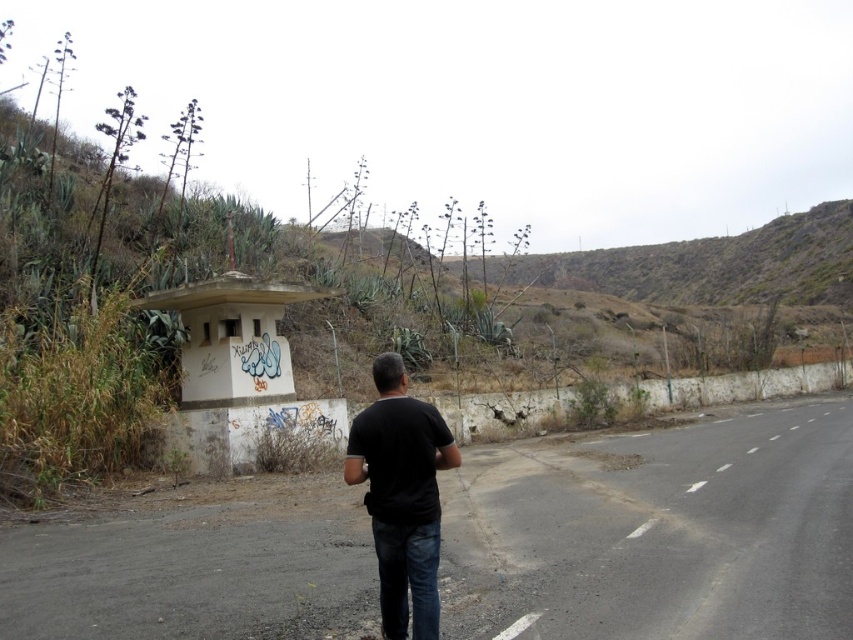
You are a pedestrian standing at the roadside. You see the smooth asphalt road at center and the black matte shirt at center. Which object is taller?

The black matte shirt at center is taller than the smooth asphalt road at center.